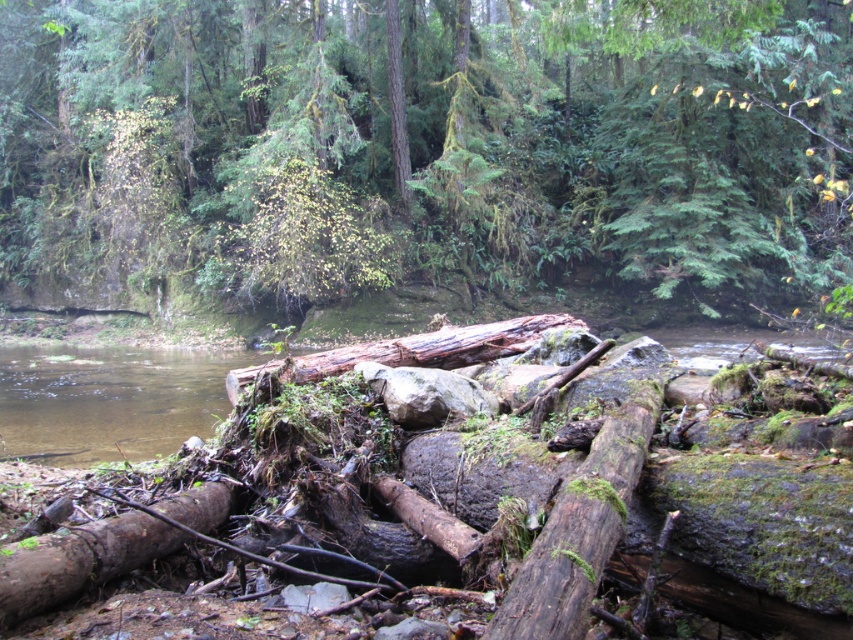
Is green mossy log at center above moss-covered wood at center?

Correct, green mossy log at center is located above moss-covered wood at center.

Does green mossy log at center appear under moss-covered wood at center?

Actually, green mossy log at center is above moss-covered wood at center.

At what (x,y) coordinates should I click in order to perform the action: click on green mossy log at center. Please return your answer as a coordinate pair (x, y). This screenshot has width=853, height=640. Looking at the image, I should click on (427, 144).

Between green mossy log at center and brown rough log at lower left, which one has less height?

brown rough log at lower left

Can you confirm if green mossy log at center is positioned below brown rough log at lower left?

Incorrect, green mossy log at center is not positioned below brown rough log at lower left.

Identify the location of green mossy log at center. (427, 144).

Where is `green mossy log at center`? This screenshot has height=640, width=853. green mossy log at center is located at coordinates (427, 144).

Can you confirm if moss-covered wood at center is smaller than brown rough log at lower left?

Actually, moss-covered wood at center might be larger than brown rough log at lower left.

Is point (517, 586) closer to viewer compared to point (146, 518)?

That is True.

Where is `moss-covered wood at center`? moss-covered wood at center is located at coordinates (579, 529).

Find the location of a particular element. moss-covered wood at center is located at coordinates (579, 529).